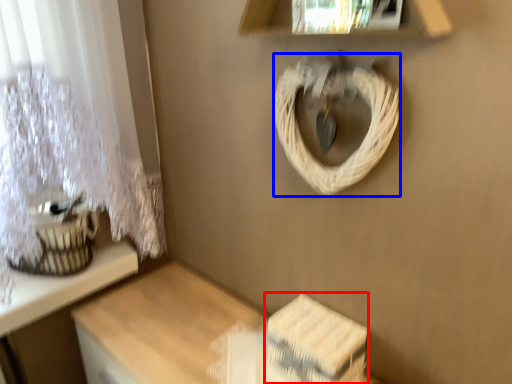
Question: Which of the following is the farthest to the observer, storage box (highlighted by a red box) or rope (highlighted by a blue box)?

Choices:
 (A) storage box
 (B) rope

Answer: (A)